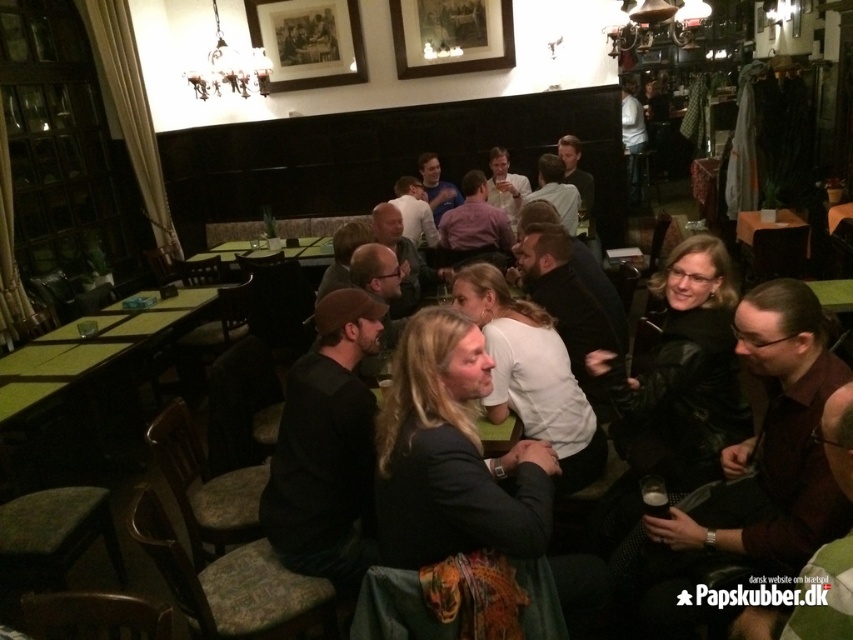
You are a person who is 5 feet tall standing in front of the dark brown leather jacket at center. Can you see the top of the jacket?

The dark brown leather jacket at center is 4.98 feet from viewer. Since you are 5 feet tall, you can see the top of the jacket.

You are a server in this pub and need to place a new drink order on the table. However, there is a dark brown leather jacket at center currently on the green wooden table at center. Since the jacket is taller than the table, will it block the space where you want to place the drink?

The dark brown leather jacket at center is taller than the green wooden table at center, so placing the drink might be obstructed by the jacket since it extends above the table surface.

You are a server in the pub and need to deliver a drink to a customer seated at the green wooden table at center. The dark brown leather jacket at center is blocking your path. Which side of the table should you go around to reach the customer without moving the jacket?

Since the dark brown leather jacket at center is to the right of the green wooden table at center, you should go around the left side of the table to reach the customer without moving the jacket.